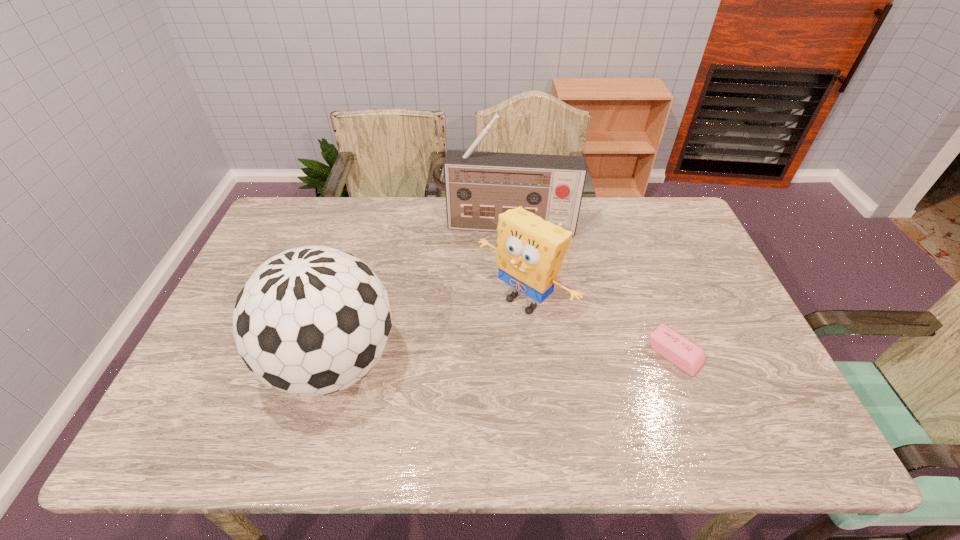
Where is `free spot located on the front panel of the farthest object`? This screenshot has height=540, width=960. free spot located on the front panel of the farthest object is located at coordinates (496, 267).

The width and height of the screenshot is (960, 540). Identify the location of free space located on the face of the sponge. (414, 400).

Locate an element on the screen. The height and width of the screenshot is (540, 960). vacant space located on the face of the sponge is located at coordinates (426, 388).

Locate an element on the screen. vacant area located on the face of the sponge is located at coordinates (474, 344).

Where is `object that is at the far edge`? This screenshot has height=540, width=960. object that is at the far edge is located at coordinates (479, 186).

Identify the location of soccer ball situated at the near edge. Image resolution: width=960 pixels, height=540 pixels. (310, 321).

Find the location of `eraser present at the near edge`. eraser present at the near edge is located at coordinates 690,358.

Where is `object that is at the right edge`? object that is at the right edge is located at coordinates (690, 358).

Where is `object located in the near right corner section of the desktop`? The height and width of the screenshot is (540, 960). object located in the near right corner section of the desktop is located at coordinates pos(690,358).

The image size is (960, 540). In the image, there is a desktop. Identify the location of free region at the far edge. (336, 223).